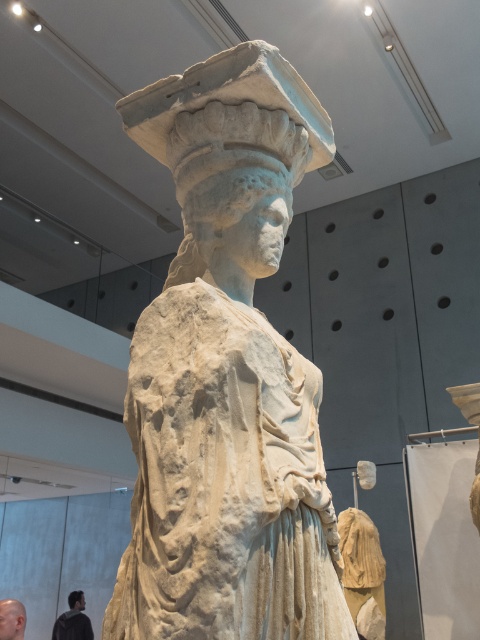
Question: Which of these objects is positioned closest to the bald skin at lower left?

Choices:
 (A) white marble statue at center
 (B) dark brown leather jacket at lower left
 (C) white marble head at center
 (D) matte gray stone head at center

Answer: (B)

Question: Among these points, which one is farthest from the camera?

Choices:
 (A) (205, 264)
 (B) (205, 397)
 (C) (72, 605)

Answer: (C)

Question: Does dark brown leather jacket at lower left have a greater width compared to bald skin at lower left?

Choices:
 (A) yes
 (B) no

Answer: (A)

Question: Is bald skin at lower left below matte gray stone head at center?

Choices:
 (A) no
 (B) yes

Answer: (A)

Question: Which point is closer to the camera taking this photo?

Choices:
 (A) (75, 608)
 (B) (254, 202)

Answer: (B)

Question: Is white marble statue at center to the left of bald skin at lower left from the viewer's perspective?

Choices:
 (A) no
 (B) yes

Answer: (A)